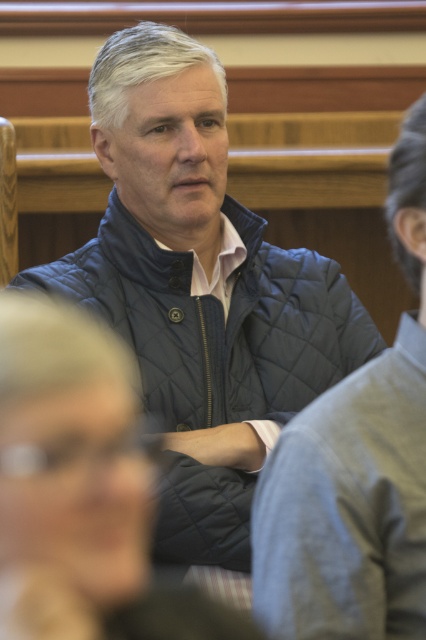
You are standing in the room where the man is seated. You want to take a photo of the point at coordinate (124, 412). Is the point within the camera frame?

The point at coordinate (124, 412) is 1.03 meters away from the camera, so it is within the camera frame.

You are standing in the room and want to move from the point closer to you to the point further away. Which path would you take to go from the point at coordinates point (x=62, y=372) to the point at coordinates point (x=394, y=596)?

The path would go from the point at coordinates point (x=62, y=372) to the point at coordinates point (x=394, y=596) by moving towards the upper right direction since point (x=62, y=372) is closer to the viewer and point (x=394, y=596) is further away.

You are a fashion stylist trying to arrange two quilted jackets for a photoshoot. The scene shows a man wearing a quilted blue jacket at center and a quilted navy jacket at center in the background. Which jacket should you place lower in the arrangement to match the scene?

The quilted blue jacket at center should be placed lower because it is located below the quilted navy jacket at center in the scene.